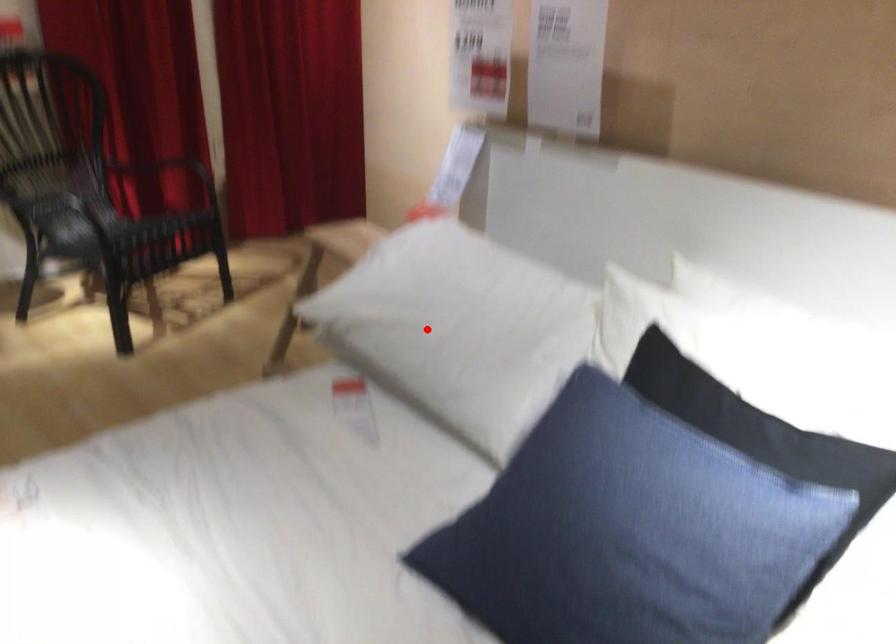
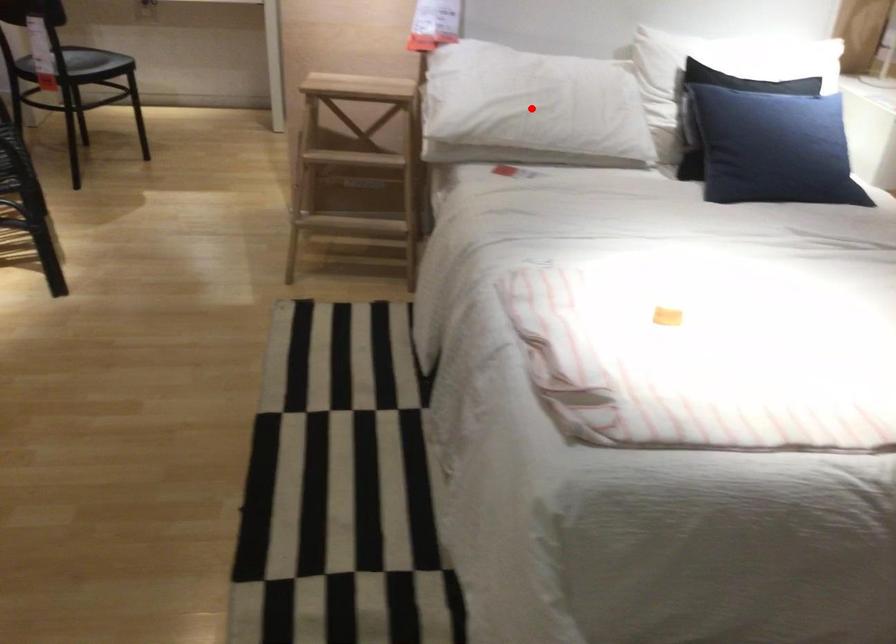
I am providing you with two images of the same scene from different viewpoints. A red point is marked on the first image and another point is marked on the second image. Are the points marked in image1 and image2 representing the same 3D position?

Yes